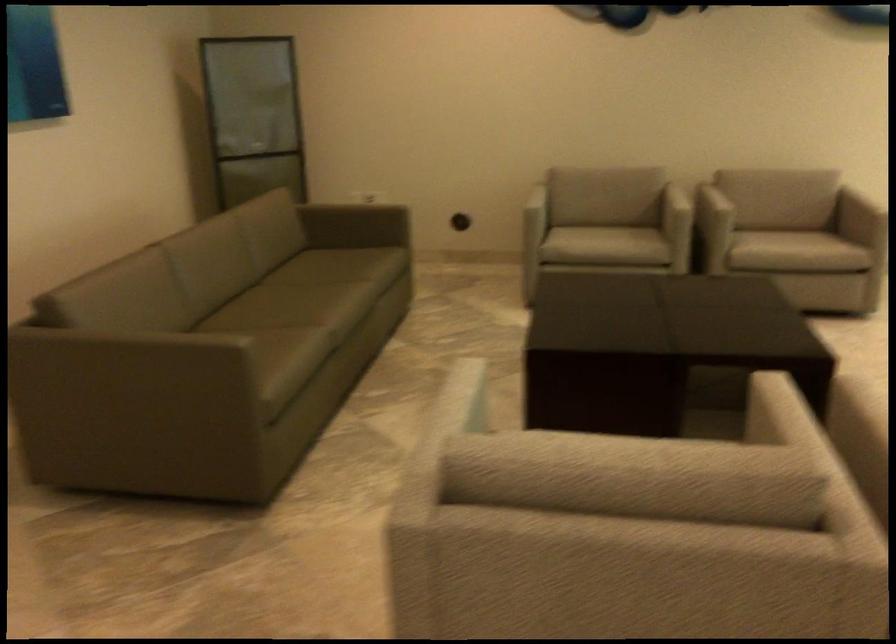
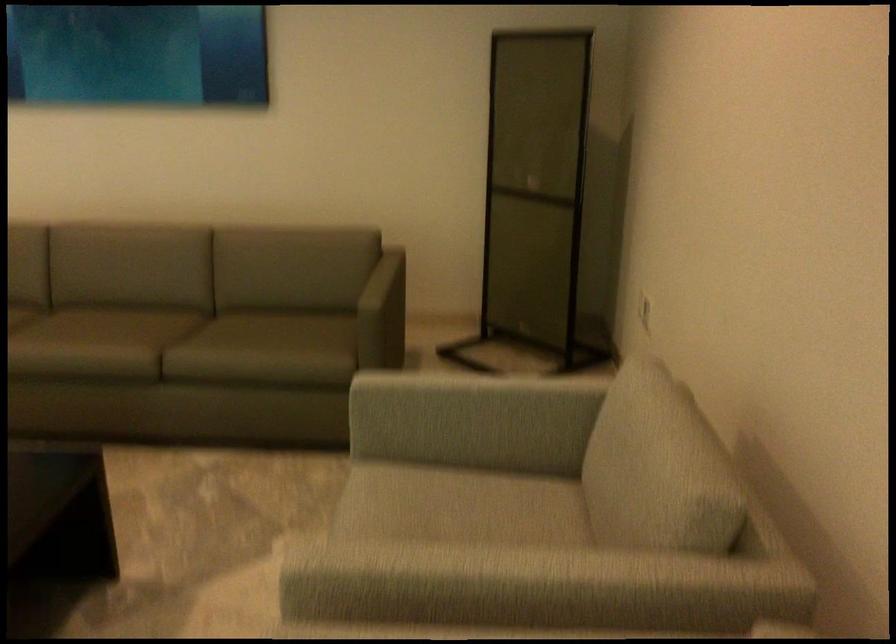
The point at (x=557, y=228) is marked in the first image. Where is the corresponding point in the second image?

(455, 491)